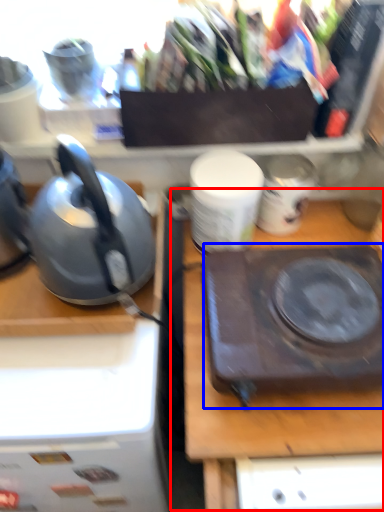
Question: Which point is further to the camera, table (highlighted by a red box) or kitchen appliance (highlighted by a blue box)?

Choices:
 (A) table
 (B) kitchen appliance

Answer: (A)